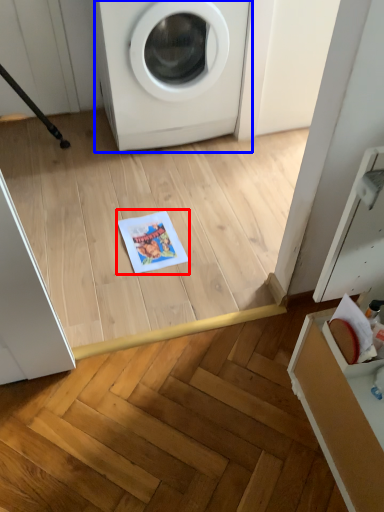
Question: Which object is closer to the camera taking this photo, copy (highlighted by a red box) or washing machine (highlighted by a blue box)?

Choices:
 (A) copy
 (B) washing machine

Answer: (B)